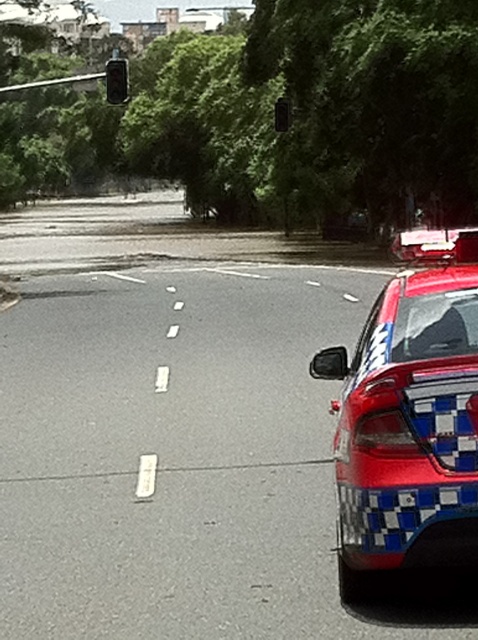
Question: Does metallic black traffic light at upper left have a larger size compared to metallic traffic light at upper center?

Choices:
 (A) no
 (B) yes

Answer: (B)

Question: Based on their relative distances, which object is nearer to the red glossy police car at right?

Choices:
 (A) metallic black traffic light at upper left
 (B) metallic traffic light at upper center

Answer: (A)

Question: Does red glossy police car at right come behind metallic black traffic light at upper left?

Choices:
 (A) yes
 (B) no

Answer: (B)

Question: Which point is closer to the camera?

Choices:
 (A) (126, 67)
 (B) (434, 326)

Answer: (B)

Question: Is red glossy police car at right behind metallic traffic light at upper center?

Choices:
 (A) no
 (B) yes

Answer: (A)

Question: Which point is closer to the camera taking this photo?

Choices:
 (A) (x=108, y=88)
 (B) (x=465, y=404)

Answer: (B)